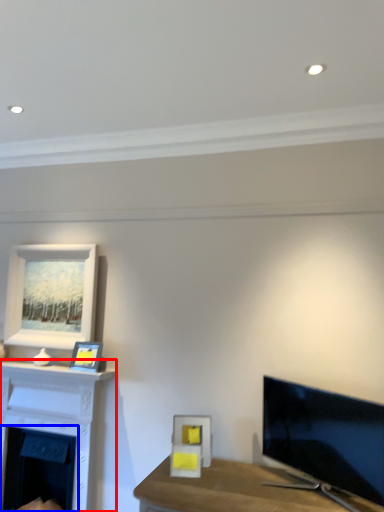
Question: Which point is closer to the camera, fireplace (highlighted by a red box) or fireplace (highlighted by a blue box)?

Choices:
 (A) fireplace
 (B) fireplace

Answer: (A)